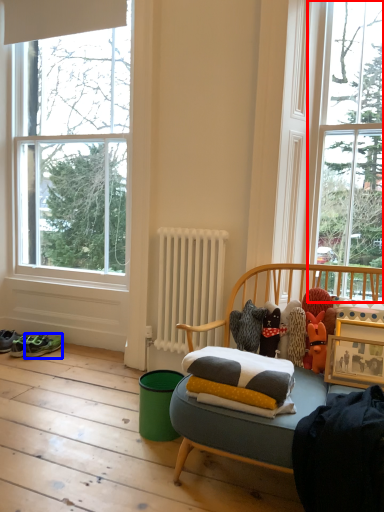
Question: Among these objects, which one is nearest to the camera, window (highlighted by a red box) or running shoe (highlighted by a blue box)?

Choices:
 (A) window
 (B) running shoe

Answer: (A)